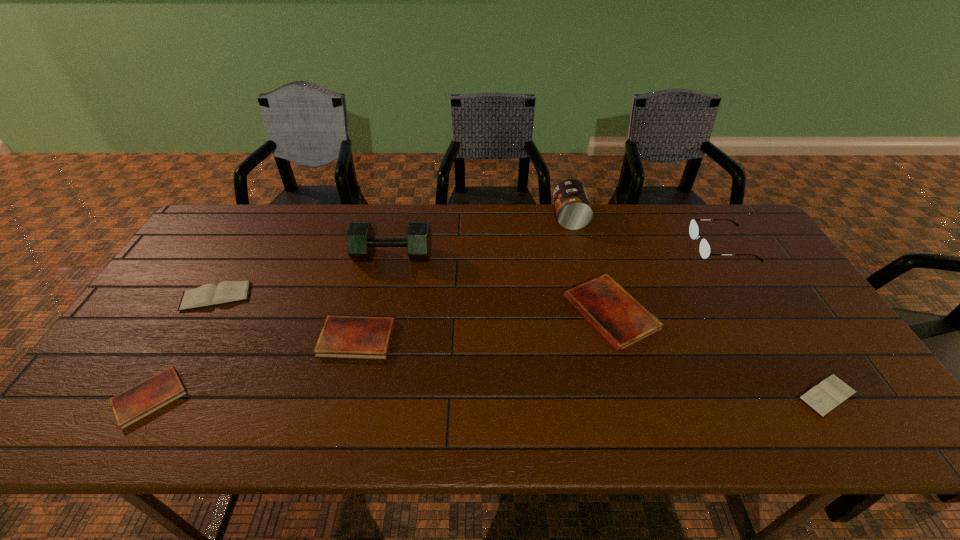
This screenshot has height=540, width=960. Identify the location of object that stands as the fifth closest to the can. (830, 393).

The width and height of the screenshot is (960, 540). In order to click on diary that stands as the second closest to the leftmost red diary in this screenshot , I will do `click(360, 337)`.

Locate an element on the screen. The width and height of the screenshot is (960, 540). diary that is the second closest one to the second diary from right to left is located at coordinates (360, 337).

The height and width of the screenshot is (540, 960). What are the coordinates of `the closest red diary to the dumbbell` in the screenshot? It's located at (360, 337).

Locate an element on the screen. This screenshot has width=960, height=540. red diary that can be found as the second closest to the can is located at coordinates (360, 337).

This screenshot has height=540, width=960. I want to click on free space that satisfies the following two spatial constraints: 1. on the front side of the right brown diary; 2. on the left side of the bigger brown diary, so click(x=157, y=396).

Find the location of a particular element. This screenshot has width=960, height=540. vacant point that satisfies the following two spatial constraints: 1. on the front label of the can; 2. on the front side of the left brown diary is located at coordinates (589, 296).

What are the coordinates of `free region that satisfies the following two spatial constraints: 1. on the lenses of the black spectacles; 2. on the front side of the farther brown diary` in the screenshot? It's located at click(753, 296).